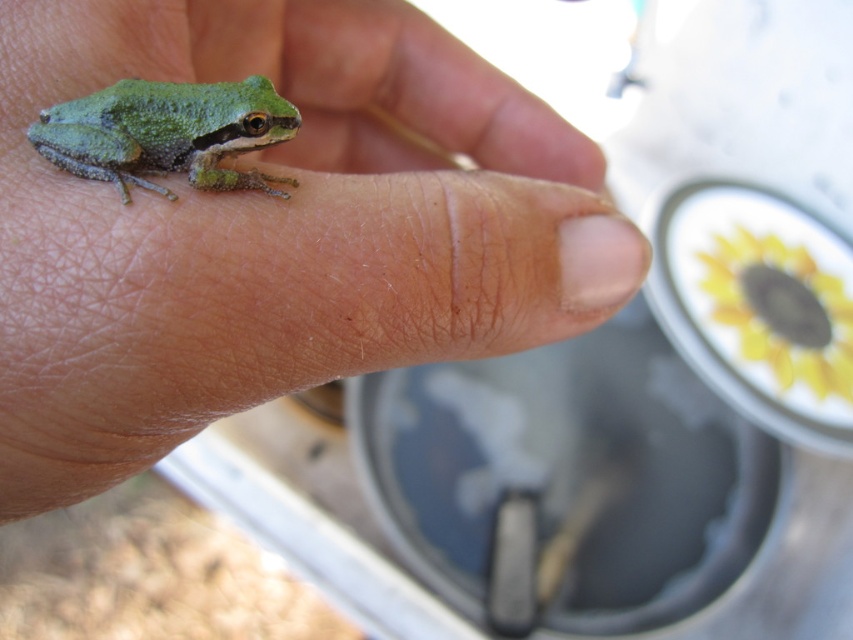
What is the 2D coordinate of the green matte skin at center in the image?

The 2D coordinate of the green matte skin at center is at point (276, 228).

You are a photographer trying to capture the frog on the hand. The frog is at point (276, 228). To ensure the frog is in focus, where should you aim your camera lens? Please provide the coordinates as a point in the format point followed by parentheses with the numbers separated by a comma.

The green matte skin at center is represented by point (276, 228), so you should aim your camera lens at point (276, 228) to ensure the frog is in focus.

You are a photographer trying to capture the frog on the hand. You need to adjust your camera focus to the frog first. Which object should you focus on first, the green matte skin at center or the green matte frog at center?

You should focus on the green matte frog at center first because the green matte skin at center is to the right of it, meaning the frog is closer to the camera.